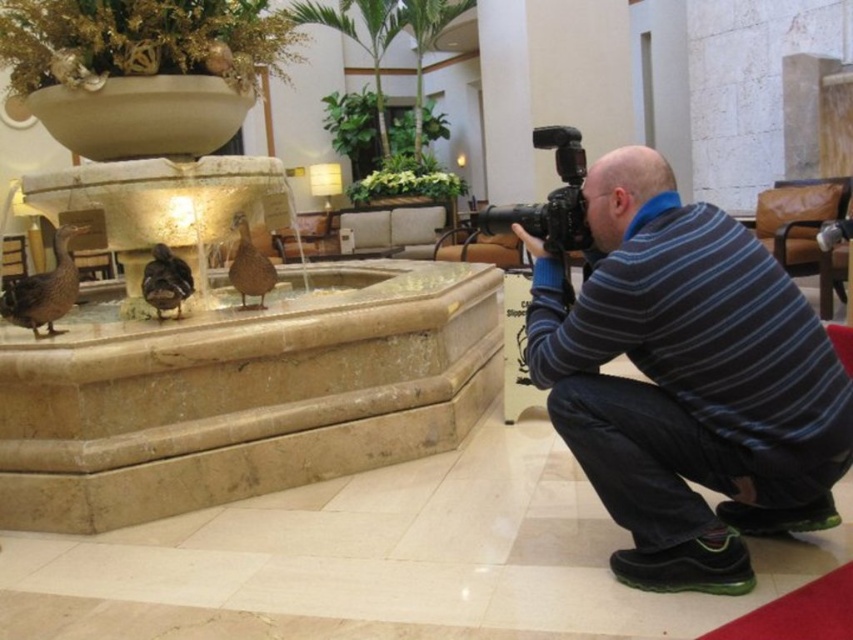
Based on the photo, is beige marble fountain at lower left thinner than black plastic video camera at center?

No.

Can you confirm if beige marble fountain at lower left is taller than black plastic video camera at center?

Yes.

Is point (344, 355) more distant than point (554, 154)?

No, (344, 355) is in front of (554, 154).

You are a GUI agent. You are given a task and a screenshot of the screen. Output one action in this format:
    pyautogui.click(x=<x>, y=<y>)
    Task: Click on the beige marble fountain at lower left
    The width and height of the screenshot is (853, 640).
    Given the screenshot: What is the action you would take?
    pyautogui.click(x=229, y=362)

Is point (799, 406) behind point (573, 141)?

No, it is not.

Is blue striped sweater at lower right taller than black plastic video camera at center?

Yes.

Image resolution: width=853 pixels, height=640 pixels. Describe the element at coordinates (688, 380) in the screenshot. I see `blue striped sweater at lower right` at that location.

Image resolution: width=853 pixels, height=640 pixels. I want to click on blue striped sweater at lower right, so click(x=688, y=380).

Based on the photo, which is more to the right, beige marble fountain at lower left or blue striped sweater at lower right?

blue striped sweater at lower right

Is point (67, 529) positioned before point (764, 321)?

No, (67, 529) is further to viewer.

You are a GUI agent. You are given a task and a screenshot of the screen. Output one action in this format:
    pyautogui.click(x=<x>, y=<y>)
    Task: Click on the beige marble fountain at lower left
    The width and height of the screenshot is (853, 640).
    Given the screenshot: What is the action you would take?
    pyautogui.click(x=229, y=362)